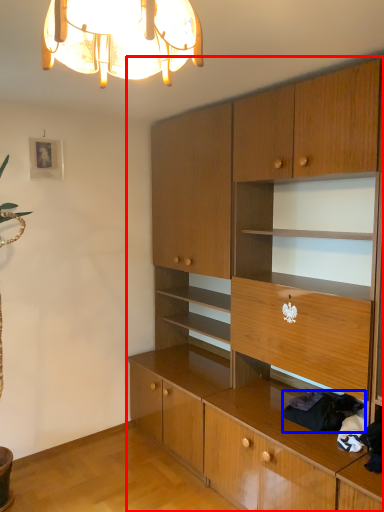
Question: Which object is further to the camera taking this photo, cabinetry (highlighted by a red box) or clothing (highlighted by a blue box)?

Choices:
 (A) cabinetry
 (B) clothing

Answer: (B)